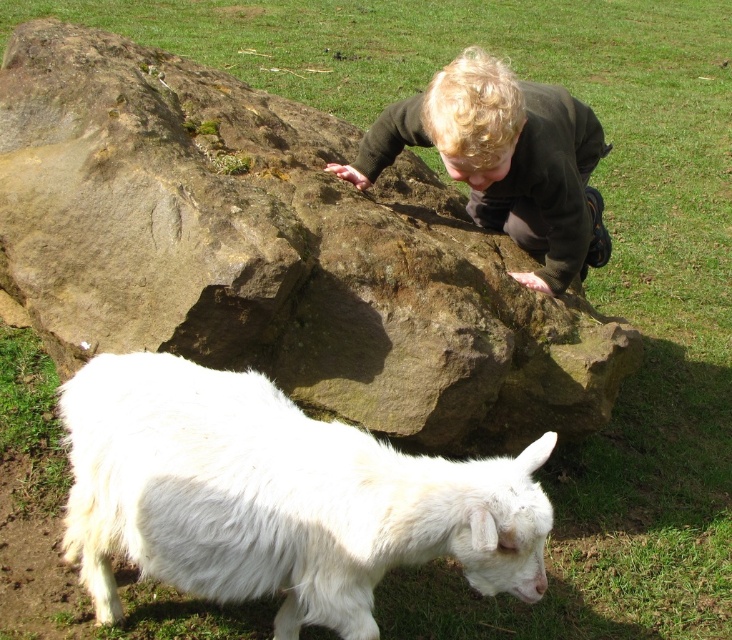
You are standing at the point marked by the coordinates point (274, 252). Looking around, you see a brown rough rock at center. What is the nearest object to you?

The nearest object to you is the brown rough rock at center, as you are standing exactly at the point that marks its location.

You are standing at the center of the grassy area and want to reach the brown rough rock at center. Which direction should you move to get there?

The brown rough rock at center is already at the center of the scene, so you are already at the correct location.